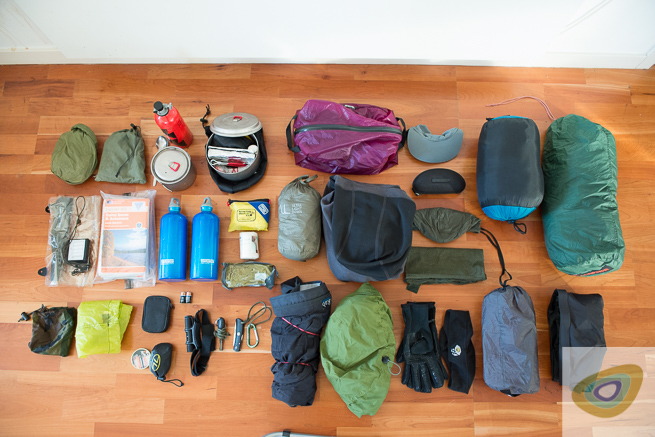
Find the location of a particular element. The image size is (655, 437). bottle is located at coordinates (204, 241).